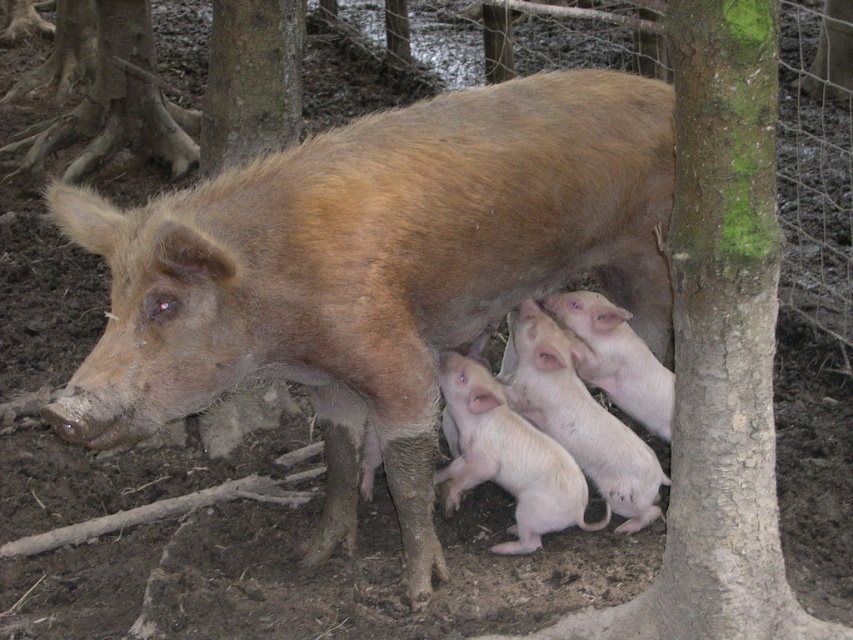
Is pink smooth piglets at center to the right of smooth pink piglets at center from the viewer's perspective?

In fact, pink smooth piglets at center is to the left of smooth pink piglets at center.

What do you see at coordinates (508, 458) in the screenshot? Image resolution: width=853 pixels, height=640 pixels. I see `pink smooth piglets at center` at bounding box center [508, 458].

Locate an element on the screen. pink smooth piglets at center is located at coordinates (508, 458).

Describe the element at coordinates (375, 269) in the screenshot. I see `brown matte piglet at lower center` at that location.

Does brown matte piglet at lower center have a larger size compared to smooth pink piglets at center?

Indeed, brown matte piglet at lower center has a larger size compared to smooth pink piglets at center.

Does point (379, 339) lie behind point (654, 499)?

No, (379, 339) is in front of (654, 499).

Locate an element on the screen. Image resolution: width=853 pixels, height=640 pixels. brown matte piglet at lower center is located at coordinates (375, 269).

Does brown matte piglet at lower center have a lesser height compared to green rough bark at upper center?

In fact, brown matte piglet at lower center may be taller than green rough bark at upper center.

Which is more to the right, brown matte piglet at lower center or green rough bark at upper center?

brown matte piglet at lower center is more to the right.

Identify the location of brown matte piglet at lower center. (375, 269).

Find the location of a particular element. The width and height of the screenshot is (853, 640). brown matte piglet at lower center is located at coordinates (375, 269).